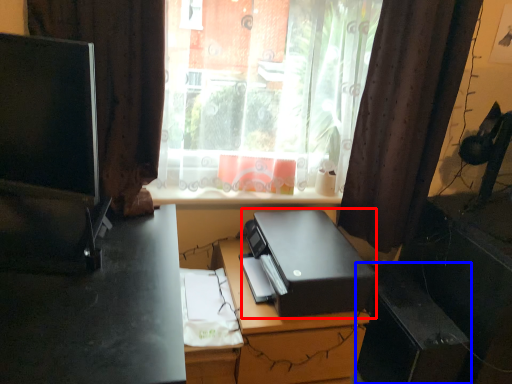
Question: Among these objects, which one is nearest to the camera, printer (highlighted by a red box) or file cabinet (highlighted by a blue box)?

Choices:
 (A) printer
 (B) file cabinet

Answer: (A)